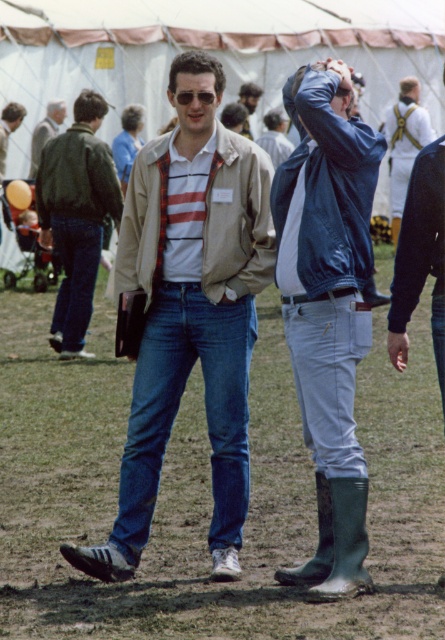
Question: Is denim jeans at center smaller than matte brown jacket at center?

Choices:
 (A) yes
 (B) no

Answer: (A)

Question: Where is blue leather jacket at center located in relation to matte brown jacket at center in the image?

Choices:
 (A) above
 (B) below

Answer: (B)

Question: Among these objects, which one is farthest from the camera?

Choices:
 (A) blue denim jeans at lower left
 (B) blue leather jacket at center
 (C) matte beige jacket at center

Answer: (A)

Question: Which object appears farthest from the camera in this image?

Choices:
 (A) white matte uniform at upper center
 (B) matte green jacket at left

Answer: (A)

Question: Can you confirm if white matte uniform at upper center is positioned to the left of shiny black sunglasses at center?

Choices:
 (A) no
 (B) yes

Answer: (A)

Question: Which object appears closest to the camera in this image?

Choices:
 (A) shiny black sunglasses at center
 (B) matte black jacket at center

Answer: (A)